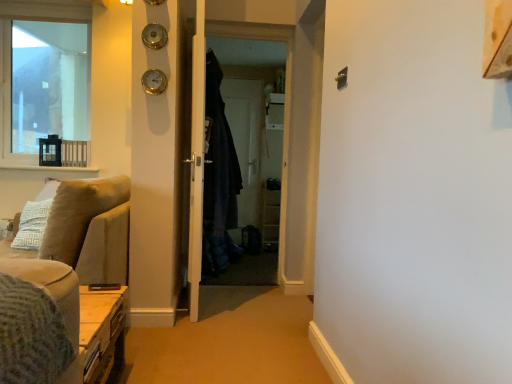
Where is `green knitted blanket at lower left`? green knitted blanket at lower left is located at coordinates (31, 334).

Where is `dark blue fabric robe at center`? dark blue fabric robe at center is located at coordinates (219, 180).

The height and width of the screenshot is (384, 512). Describe the element at coordinates (272, 170) in the screenshot. I see `white wood shelving unit at center` at that location.

Measure the distance between point [83,107] and camera.

A distance of 4.38 meters exists between point [83,107] and camera.

Image resolution: width=512 pixels, height=384 pixels. What do you see at coordinates (196, 159) in the screenshot?
I see `white wood door at center` at bounding box center [196, 159].

What do you see at coordinates (246, 143) in the screenshot?
I see `dark fabric screen door at center, the 2th screen door from the front` at bounding box center [246, 143].

Locate an element on the screen. beige fabric couch at left is located at coordinates (90, 229).

Which is more to the left, dark blue fabric robe at center or white wood shelving unit at center?

From the viewer's perspective, dark blue fabric robe at center appears more on the left side.

Considering the positions of point (217, 98) and point (278, 201), is point (217, 98) closer or farther from the camera than point (278, 201)?

Point (217, 98) appears to be closer to the viewer than point (278, 201).

Is there a large distance between dark blue fabric robe at center and white wood shelving unit at center?

Yes, dark blue fabric robe at center and white wood shelving unit at center are located far from each other.

Is dark blue fabric robe at center aimed at white wood shelving unit at center?

No, dark blue fabric robe at center is not facing towards white wood shelving unit at center.

Is dark fabric screen door at center, the first screen door from the back, facing towards clear glass window at upper left?

No, dark fabric screen door at center, the first screen door from the back, does not turn towards clear glass window at upper left.

Does dark fabric screen door at center, the 2th screen door from the front, contain clear glass window at upper left?

No, dark fabric screen door at center, the 2th screen door from the front, does not contain clear glass window at upper left.

Is dark fabric screen door at center, the first screen door from the back, at the left side of clear glass window at upper left?

No, dark fabric screen door at center, the first screen door from the back, is not to the left of clear glass window at upper left.

Which is farther, [253,118] or [34,158]?

Positioned behind is point [253,118].

Which point is more forward, [213,211] or [197,129]?

The point [197,129] is closer to the camera.

Can you confirm if dark blue fabric robe at center is thinner than white wood door at center?

In fact, dark blue fabric robe at center might be wider than white wood door at center.

Which object is more forward, dark blue fabric robe at center or white wood door at center?

white wood door at center is more forward.

Is dark blue fabric robe at center smaller than white wood door at center?

Actually, dark blue fabric robe at center might be larger than white wood door at center.

Considering the sizes of objects clear glass window at upper left and beige fabric couch at left in the image provided, who is smaller, clear glass window at upper left or beige fabric couch at left?

clear glass window at upper left.

Locate an element on the screen. window located behind the beige fabric couch at left is located at coordinates (42, 76).

From the image's perspective, would you say clear glass window at upper left is positioned over beige fabric couch at left?

Yes, from the image's perspective, clear glass window at upper left is over beige fabric couch at left.

Which object is positioned more to the right, clear glass window at upper left or beige fabric couch at left?

Positioned to the right is beige fabric couch at left.

Is point (191, 305) in front of point (191, 112)?

No, it is behind (191, 112).

Is dark fabric screen door at center, which appears as the first screen door when viewed from the front, not close to white wood door at center?

No.

Looking at this image, can we say white wood door at center lies outside beige fabric couch at left?

Yes, white wood door at center is outside of beige fabric couch at left.

What's the angular difference between white wood door at center and beige fabric couch at left's facing directions?

There is a 172-degree angle between the facing directions of white wood door at center and beige fabric couch at left.

Which of these two, white wood door at center or beige fabric couch at left, is bigger?

beige fabric couch at left.

In the scene shown: Does white wood door at center lie behind beige fabric couch at left?

Yes, white wood door at center is further from the camera.

Which is more to the left, white wood door at center or green knitted blanket at lower left?

green knitted blanket at lower left.

Which of these two, white wood door at center or green knitted blanket at lower left, stands shorter?

green knitted blanket at lower left.

Consider the image. From a real-world perspective, relative to green knitted blanket at lower left, is white wood door at center vertically above or below?

white wood door at center is situated higher than green knitted blanket at lower left in the real world.

From the picture: Is white wood door at center positioned before green knitted blanket at lower left?

No, it is behind green knitted blanket at lower left.

You are a GUI agent. You are given a task and a screenshot of the screen. Output one action in this format:
    pyautogui.click(x=<x>, y=<y>)
    Task: Click on the robe above the white wood shelving unit at center (from the image's perspective)
    
    Given the screenshot: What is the action you would take?
    pyautogui.click(x=219, y=180)

Locate an element on the screen. window in front of the dark fabric screen door at center, the 2th screen door from the front is located at coordinates (42, 76).

Estimate the real-world distances between objects in this image. Which object is further from dark fabric screen door at center, which is the 2th screen door from back to front, green knitted blanket at lower left or white wood door at center?

Among the two, green knitted blanket at lower left is located further to dark fabric screen door at center, which is the 2th screen door from back to front.

Considering their positions, is green knitted blanket at lower left positioned closer to white wood shelving unit at center than dark blue fabric robe at center?

dark blue fabric robe at center is positioned closer to the anchor white wood shelving unit at center.

Based on their spatial positions, is white wood door at center or green knitted blanket at lower left closer to white wood shelving unit at center?

Among the two, white wood door at center is located nearer to white wood shelving unit at center.

Looking at the image, which one is located closer to dark blue fabric robe at center, green knitted blanket at lower left or white wood shelving unit at center?

Based on the image, white wood shelving unit at center appears to be nearer to dark blue fabric robe at center.

Which object lies nearer to the anchor point dark fabric screen door at center, the first screen door from the back, white wood shelving unit at center or green knitted blanket at lower left?

white wood shelving unit at center is closer to dark fabric screen door at center, the first screen door from the back.

Estimate the real-world distances between objects in this image. Which object is further from dark blue fabric robe at center, dark fabric screen door at center, which is the 2th screen door from back to front, or beige fabric couch at left?

Based on the image, beige fabric couch at left appears to be further to dark blue fabric robe at center.

Which object lies nearer to the anchor point white wood door at center, green knitted blanket at lower left or dark fabric screen door at center, which is the 2th screen door from back to front?

dark fabric screen door at center, which is the 2th screen door from back to front, is positioned closer to the anchor white wood door at center.

Which object lies further to the anchor point white wood shelving unit at center, dark fabric screen door at center, which appears as the first screen door when viewed from the front, or beige fabric couch at left?

beige fabric couch at left is positioned further to the anchor white wood shelving unit at center.

At what (x,y) coordinates should I click in order to perform the action: click on door located between green knitted blanket at lower left and clear glass window at upper left in the depth direction. Please return your answer as a coordinate pair (x, y). Looking at the image, I should click on (196, 159).

Identify the location of door between clear glass window at upper left and dark blue fabric robe at center in the horizontal direction. The image size is (512, 384). (196, 159).

Locate an element on the screen. robe positioned between white wood door at center and dark fabric screen door at center, the first screen door from the back, from near to far is located at coordinates (219, 180).

I want to click on robe between green knitted blanket at lower left and dark fabric screen door at center, which is the 2th screen door from back to front, along the z-axis, so click(x=219, y=180).